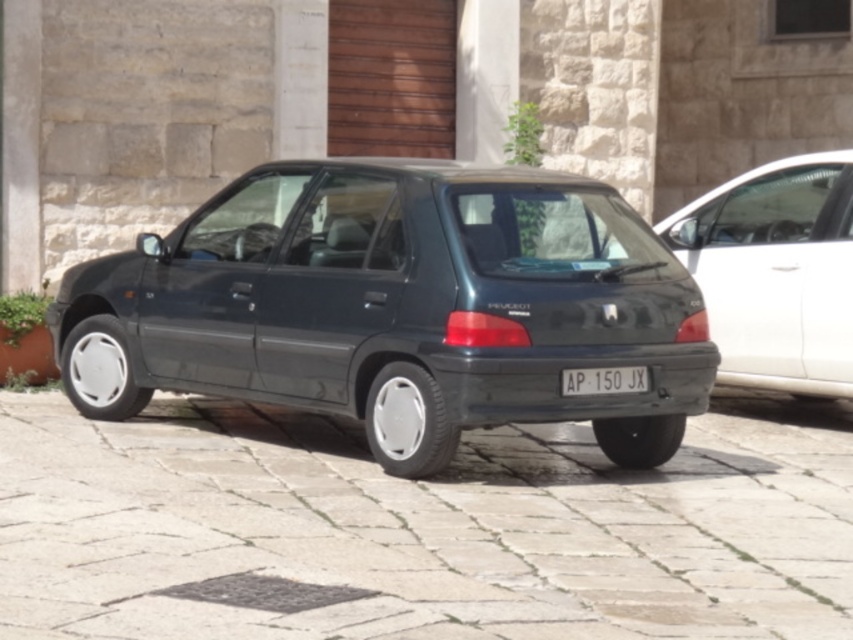
Consider the image. You are standing in front of a dark Peugeot 106 parked on a cobblestone street. You need to place a small potted plant exactly where the gray stone pavement at center is located. According to the image, where should you place the potted plant?

You should place the potted plant at point (418, 529) where the gray stone pavement at center is located.